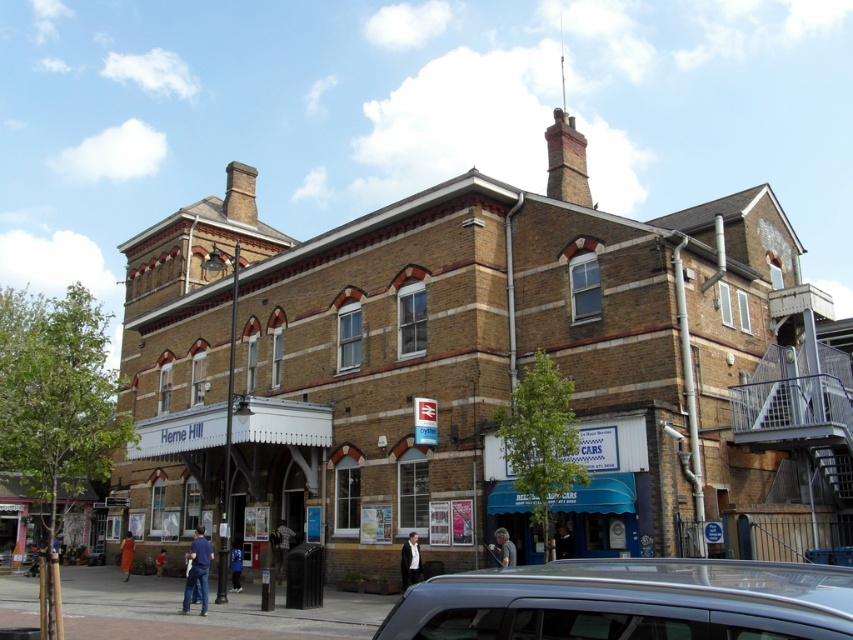
You are standing at the entrance of Herne Hill station and want to take a photo of the white wooden awning at center. There is a silver metallic car at lower right in the way. Can you move to the left to get a clear shot without the car blocking the view?

The silver metallic car at lower right is closer to the viewer than the white wooden awning at center. Moving to the left might allow you to position yourself around the car, as the awning is further back and may become visible once the car is no longer in front of it.